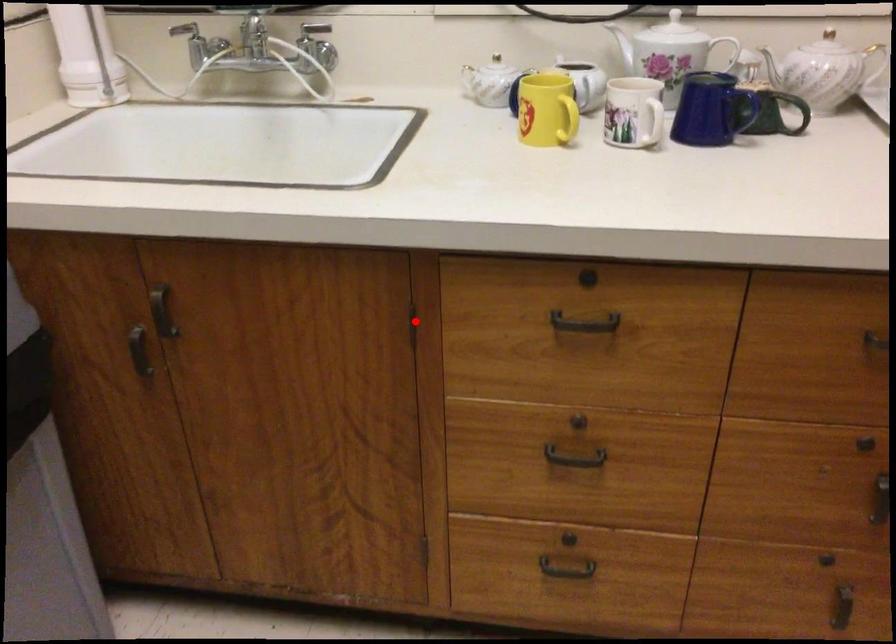
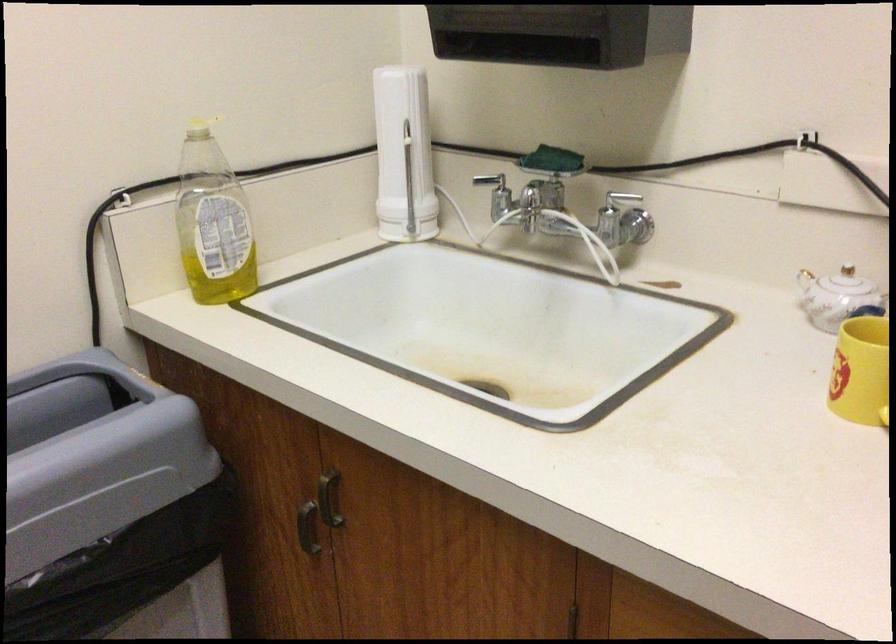
Question: I am providing you with two images of the same scene from different viewpoints. A red point is marked on the first image. Is the red point's position out of view in image 2?

Choices:
 (A) Yes
 (B) No

Answer: (B)